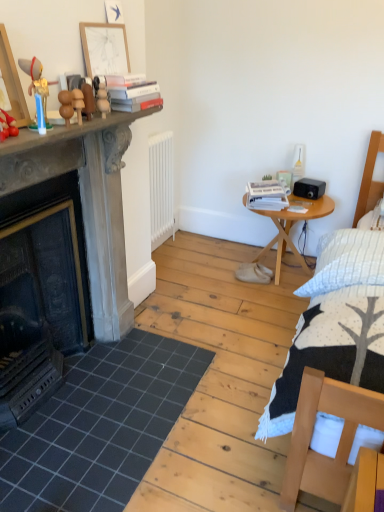
Find the location of a particular element. vacant space situated above white paper stack at right, marked as the first book in a bottom-to-top arrangement (from a real-world perspective) is located at coordinates (266, 188).